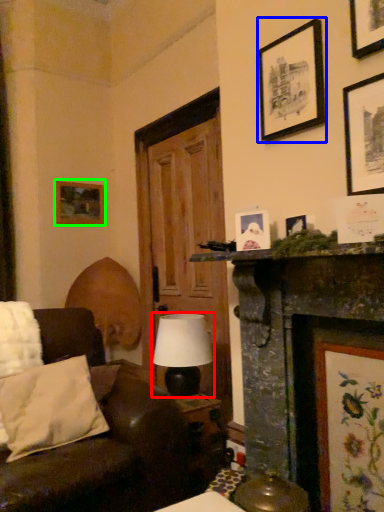
Question: Which is nearer to the table lamp (highlighted by a red box)? picture frame (highlighted by a blue box) or picture frame (highlighted by a green box).

Choices:
 (A) picture frame
 (B) picture frame

Answer: (A)